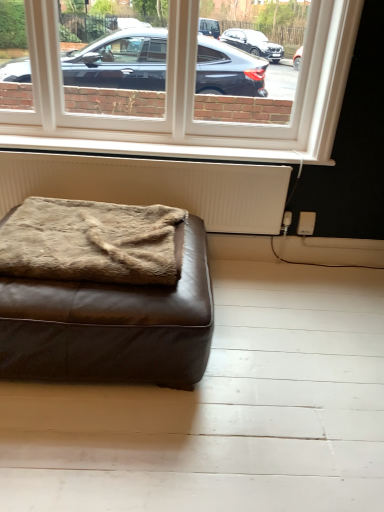
Question: From the image's perspective, is white painted wood at lower center located beneath white textured radiator at lower center?

Choices:
 (A) yes
 (B) no

Answer: (B)

Question: Does white painted wood at lower center come in front of white textured radiator at lower center?

Choices:
 (A) yes
 (B) no

Answer: (B)

Question: From a real-world perspective, is white painted wood at lower center physically below white textured radiator at lower center?

Choices:
 (A) yes
 (B) no

Answer: (B)

Question: Would you say white painted wood at lower center contains white textured radiator at lower center?

Choices:
 (A) no
 (B) yes

Answer: (A)

Question: Is white painted wood at lower center smaller than white textured radiator at lower center?

Choices:
 (A) yes
 (B) no

Answer: (A)

Question: From a real-world perspective, is brown leather ottoman at lower left positioned above or below brown fuzzy blanket at lower left?

Choices:
 (A) below
 (B) above

Answer: (A)

Question: Would you say brown leather ottoman at lower left is inside or outside brown fuzzy blanket at lower left?

Choices:
 (A) outside
 (B) inside

Answer: (A)

Question: Is brown leather ottoman at lower left bigger or smaller than brown fuzzy blanket at lower left?

Choices:
 (A) big
 (B) small

Answer: (A)

Question: Is brown leather ottoman at lower left wider or thinner than brown fuzzy blanket at lower left?

Choices:
 (A) thin
 (B) wide

Answer: (B)

Question: Do you think white textured radiator at lower center is within white painted wood at lower center, or outside of it?

Choices:
 (A) outside
 (B) inside

Answer: (A)

Question: Considering the relative positions of white textured radiator at lower center and white painted wood at lower center in the image provided, is white textured radiator at lower center to the left or to the right of white painted wood at lower center?

Choices:
 (A) left
 (B) right

Answer: (A)

Question: From a real-world perspective, is white textured radiator at lower center above or below white painted wood at lower center?

Choices:
 (A) below
 (B) above

Answer: (A)

Question: In terms of width, does white textured radiator at lower center look wider or thinner when compared to white painted wood at lower center?

Choices:
 (A) thin
 (B) wide

Answer: (A)

Question: From their relative heights in the image, would you say brown fuzzy blanket at lower left is taller or shorter than brown leather ottoman at lower left?

Choices:
 (A) short
 (B) tall

Answer: (A)

Question: Considering the positions of brown fuzzy blanket at lower left and brown leather ottoman at lower left in the image, is brown fuzzy blanket at lower left bigger or smaller than brown leather ottoman at lower left?

Choices:
 (A) big
 (B) small

Answer: (B)